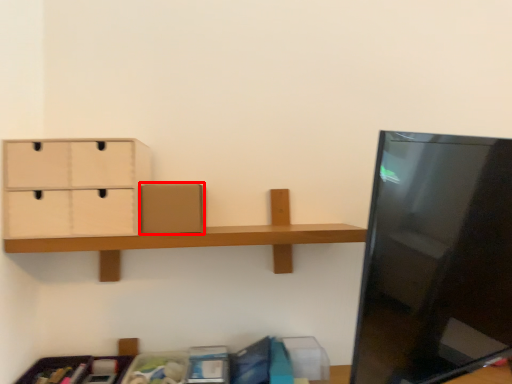
Question: Considering the relative positions of cardboard box (annotated by the red box) and drawer in the image provided, where is cardboard box (annotated by the red box) located with respect to the staircase?

Choices:
 (A) left
 (B) right

Answer: (B)